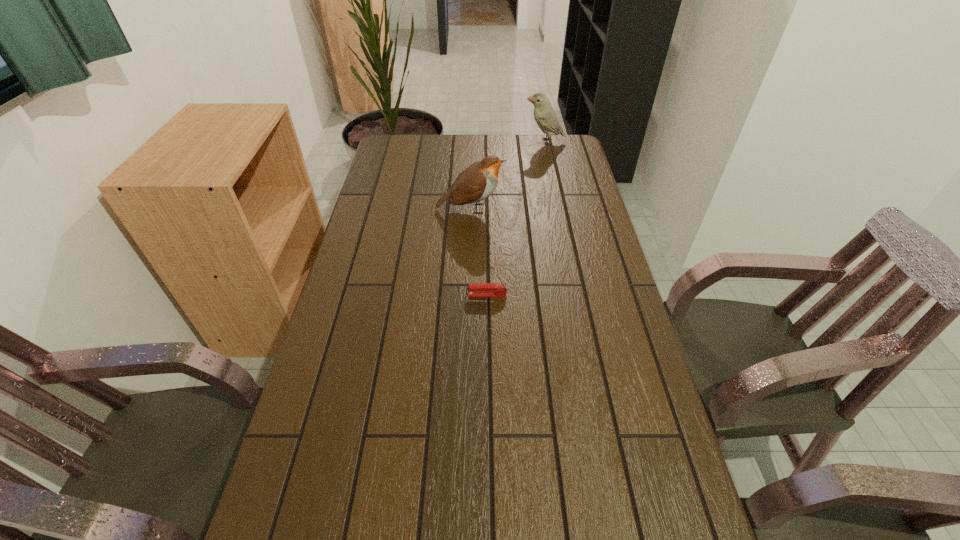
You are a GUI agent. You are given a task and a screenshot of the screen. Output one action in this format:
    pyautogui.click(x=<x>, y=<y>)
    Task: Click on the free space between the shortest object and the farthest object
    The height and width of the screenshot is (540, 960).
    Given the screenshot: What is the action you would take?
    pyautogui.click(x=516, y=218)

Find the location of a particular element. free space between the left bird and the right bird is located at coordinates (507, 175).

Where is `free space between the right bird and the nearest object`? The height and width of the screenshot is (540, 960). free space between the right bird and the nearest object is located at coordinates (516, 218).

Where is `vacant point located between the left bird and the stapler`? vacant point located between the left bird and the stapler is located at coordinates (479, 252).

At what (x,y) coordinates should I click in order to perform the action: click on object that can be found as the second closest to the farthest object. Please return your answer as a coordinate pair (x, y). Looking at the image, I should click on (479, 289).

Where is `object that can be found as the second closest to the rightmost object`? The width and height of the screenshot is (960, 540). object that can be found as the second closest to the rightmost object is located at coordinates (479, 289).